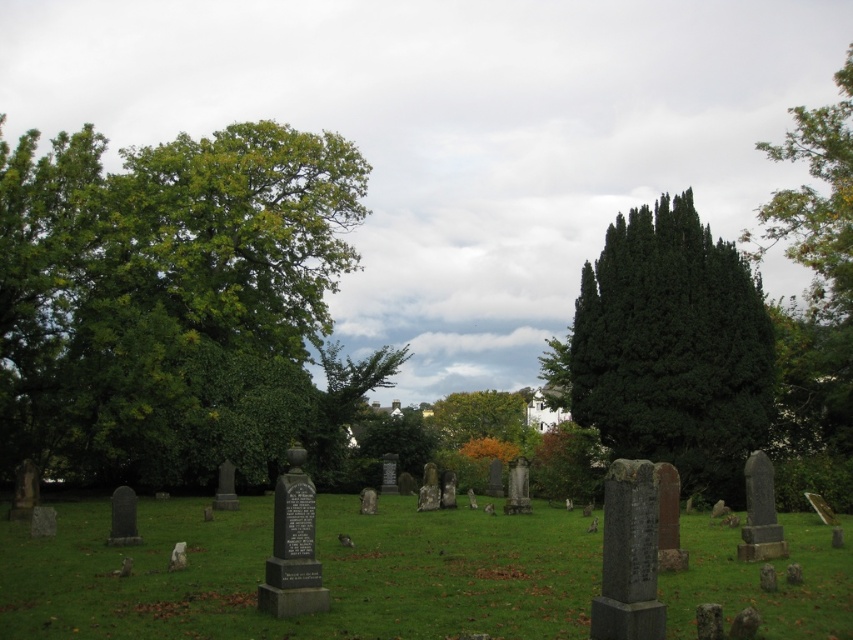
Question: Which point appears closest to the camera in this image?

Choices:
 (A) (805, 609)
 (B) (453, 401)
 (C) (747, 403)

Answer: (A)

Question: Is gray stone gravestones at center below dark green coniferous tree at center-right?

Choices:
 (A) no
 (B) yes

Answer: (B)

Question: Which of these objects is positioned farthest from the green leafy tree at left?

Choices:
 (A) gray stone gravestones at center
 (B) green leafy tree at center
 (C) dark green coniferous tree at center-right

Answer: (B)

Question: Which point is farther to the camera?

Choices:
 (A) green leafy tree at center
 (B) dark green coniferous tree at center-right

Answer: (A)

Question: Observing the image, what is the correct spatial positioning of gray stone gravestones at center in reference to dark green coniferous tree at center-right?

Choices:
 (A) right
 (B) left

Answer: (B)

Question: Can you confirm if green leafy tree at left is smaller than dark green coniferous tree at center-right?

Choices:
 (A) yes
 (B) no

Answer: (B)